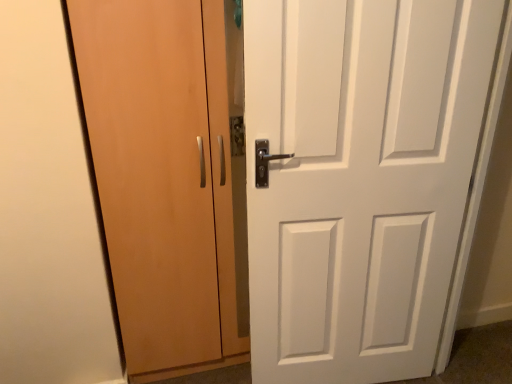
Question: From a real-world perspective, is matte wood cabinet at left, marked as the 1th door in a left-to-right arrangement, positioned above or below white matte door at center, the 2th door when ordered from left to right?

Choices:
 (A) above
 (B) below

Answer: (A)

Question: Is matte wood cabinet at left, marked as the 2th door in a right-to-left arrangement, spatially inside white matte door at center, the 2th door when ordered from left to right, or outside of it?

Choices:
 (A) outside
 (B) inside

Answer: (A)

Question: Considering the positions of matte wood cabinet at left, marked as the 1th door in a left-to-right arrangement, and white matte door at center, the 2th door when ordered from left to right, in the image, is matte wood cabinet at left, marked as the 1th door in a left-to-right arrangement, bigger or smaller than white matte door at center, the 2th door when ordered from left to right,?

Choices:
 (A) small
 (B) big

Answer: (B)

Question: Relative to matte wood cabinet at left, marked as the 2th door in a right-to-left arrangement, is white matte door at center, the 2th door when ordered from left to right, in front or behind?

Choices:
 (A) front
 (B) behind

Answer: (A)

Question: In terms of width, does white matte door at center, which is counted as the first door, starting from the right, look wider or thinner when compared to matte wood cabinet at left, marked as the 1th door in a left-to-right arrangement?

Choices:
 (A) thin
 (B) wide

Answer: (A)

Question: Choose the correct answer: Is white matte door at center, which is counted as the first door, starting from the right, inside matte wood cabinet at left, marked as the 1th door in a left-to-right arrangement, or outside it?

Choices:
 (A) inside
 (B) outside

Answer: (B)

Question: In terms of size, does white matte door at center, which is counted as the first door, starting from the right, appear bigger or smaller than matte wood cabinet at left, marked as the 1th door in a left-to-right arrangement?

Choices:
 (A) big
 (B) small

Answer: (B)